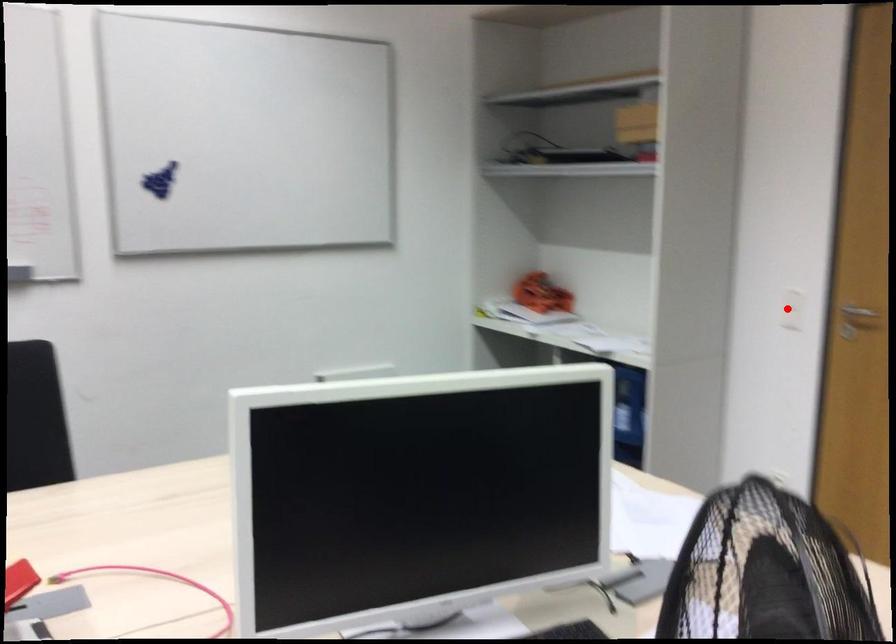
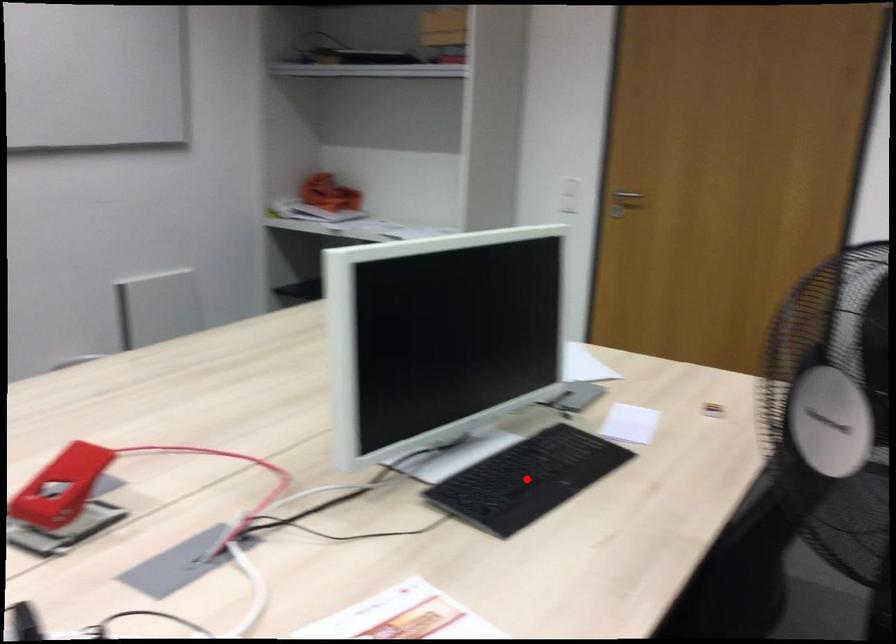
I am providing you with two images of the same scene from different viewpoints. A red point is marked on the first image and another point is marked on the second image. Do the highlighted points in image1 and image2 indicate the same real-world spot?

No